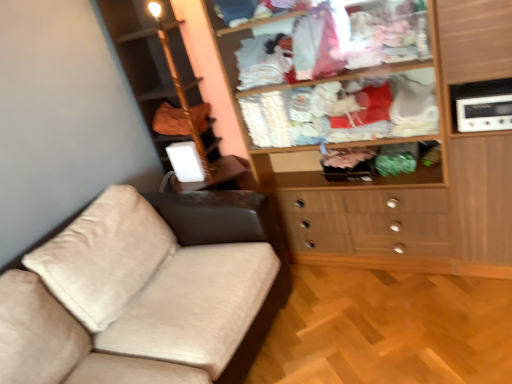
Question: Should I look upward or downward to see wooden wardrobe at upper right?

Choices:
 (A) up
 (B) down

Answer: (A)

Question: Is wooden wardrobe at upper right facing away from white plastic radio at upper right?

Choices:
 (A) yes
 (B) no

Answer: (B)

Question: Would you say wooden wardrobe at upper right is a long distance from white plastic radio at upper right?

Choices:
 (A) no
 (B) yes

Answer: (A)

Question: Can you see wooden wardrobe at upper right touching white plastic radio at upper right?

Choices:
 (A) no
 (B) yes

Answer: (A)

Question: From a real-world perspective, is wooden wardrobe at upper right physically above white plastic radio at upper right?

Choices:
 (A) yes
 (B) no

Answer: (B)

Question: Is the position of wooden wardrobe at upper right less distant than that of white plastic radio at upper right?

Choices:
 (A) no
 (B) yes

Answer: (B)

Question: Considering the relative positions of wooden wardrobe at upper right and white plastic radio at upper right in the image provided, is wooden wardrobe at upper right to the left of white plastic radio at upper right from the viewer's perspective?

Choices:
 (A) no
 (B) yes

Answer: (B)

Question: Is wooden wardrobe at upper right inside brown fabric bag at upper left?

Choices:
 (A) no
 (B) yes

Answer: (A)

Question: Is brown fabric bag at upper left taller than wooden wardrobe at upper right?

Choices:
 (A) yes
 (B) no

Answer: (B)

Question: From the image's perspective, is brown fabric bag at upper left below wooden wardrobe at upper right?

Choices:
 (A) no
 (B) yes

Answer: (A)

Question: Is brown fabric bag at upper left facing towards wooden wardrobe at upper right?

Choices:
 (A) no
 (B) yes

Answer: (A)

Question: Does brown fabric bag at upper left have a greater width compared to wooden wardrobe at upper right?

Choices:
 (A) no
 (B) yes

Answer: (A)

Question: Is brown fabric bag at upper left further to camera compared to wooden wardrobe at upper right?

Choices:
 (A) yes
 (B) no

Answer: (A)

Question: From a real-world perspective, does brown fabric bag at upper left sit lower than white plastic radio at upper right?

Choices:
 (A) no
 (B) yes

Answer: (A)